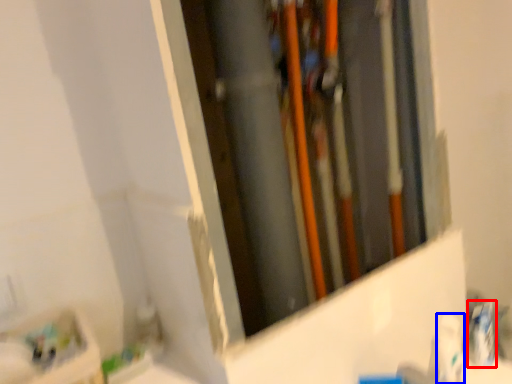
Question: Which object appears closest to the camera in this image, toothpaste (highlighted by a red box) or toiletry (highlighted by a blue box)?

Choices:
 (A) toothpaste
 (B) toiletry

Answer: (B)